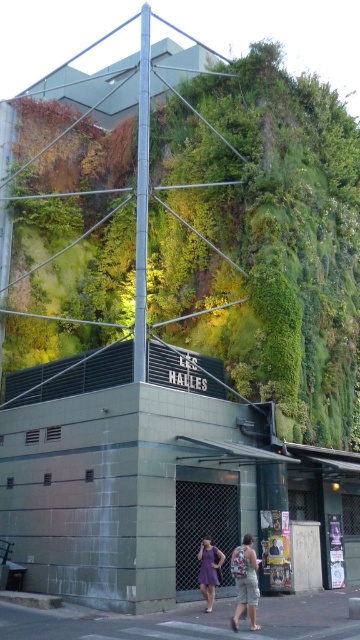
Does light purple fabric dress at center appear on the right side of purple fabric dress at center?

Yes, light purple fabric dress at center is to the right of purple fabric dress at center.

The height and width of the screenshot is (640, 360). What are the coordinates of `light purple fabric dress at center` in the screenshot? It's located at (245, 580).

Can you confirm if green mossy wall at upper center is smaller than light purple fabric dress at center?

Actually, green mossy wall at upper center might be larger than light purple fabric dress at center.

Measure the distance between point (213, 256) and camera.

Point (213, 256) is 29.40 meters from camera.

Image resolution: width=360 pixels, height=640 pixels. In order to click on green mossy wall at upper center in this screenshot , I will do `click(261, 236)`.

Between point (225, 216) and point (210, 602), which one is positioned behind?

Point (225, 216)

Is point (168, 42) less distant than point (208, 570)?

No, (168, 42) is further to viewer.

This screenshot has width=360, height=640. I want to click on green mossy wall at upper center, so click(x=261, y=236).